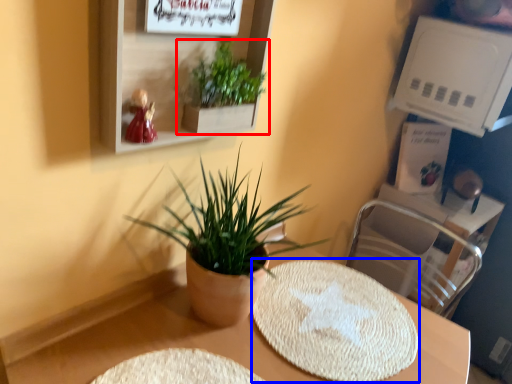
Question: Which object is further to the camera taking this photo, houseplant (highlighted by a red box) or mat (highlighted by a blue box)?

Choices:
 (A) houseplant
 (B) mat

Answer: (B)